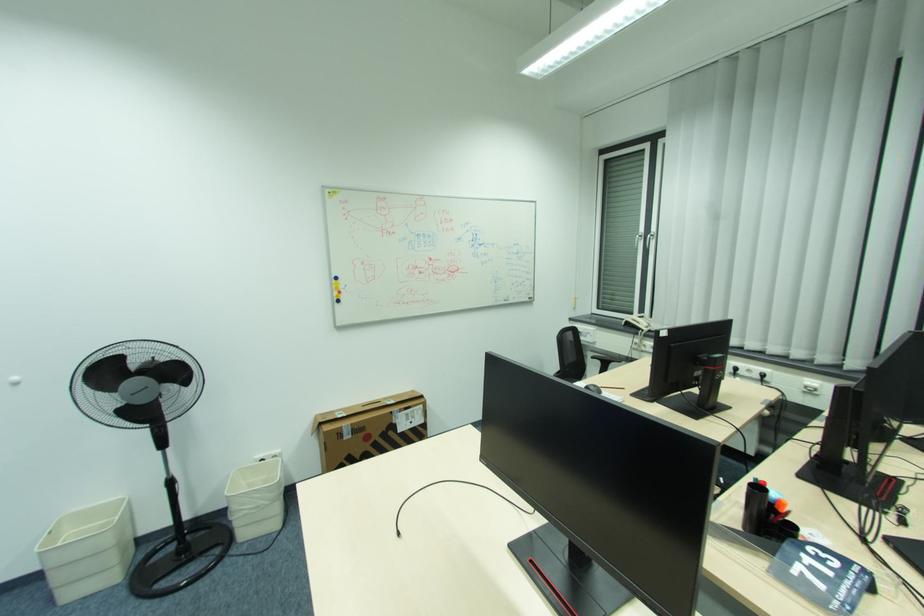
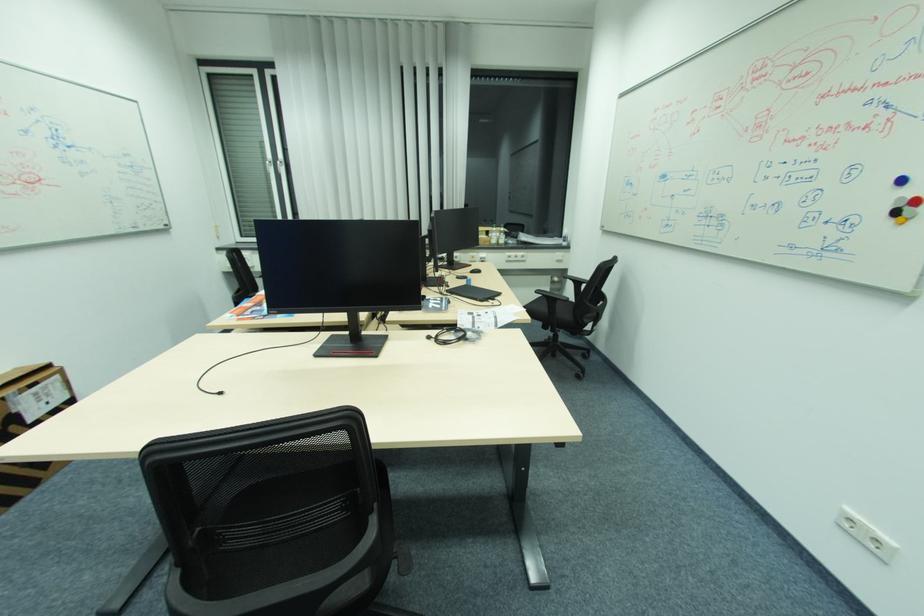
Where in the second image is the point corresponding to [396,411] from the first image?

(7, 399)